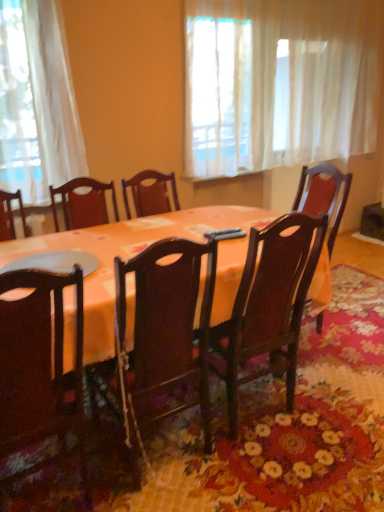
Question: Is white sheer curtain at upper center positioned beyond the bounds of orange fabric table at center?

Choices:
 (A) no
 (B) yes

Answer: (B)

Question: Is white sheer curtain at upper center further to the viewer compared to orange fabric table at center?

Choices:
 (A) yes
 (B) no

Answer: (A)

Question: Is white sheer curtain at upper center shorter than orange fabric table at center?

Choices:
 (A) yes
 (B) no

Answer: (B)

Question: Is white sheer curtain at upper center facing away from orange fabric table at center?

Choices:
 (A) no
 (B) yes

Answer: (A)

Question: Is white sheer curtain at upper center at the right side of orange fabric table at center?

Choices:
 (A) no
 (B) yes

Answer: (B)

Question: From the image's perspective, relative to white sheer curtain at upper center, is wooden chair at center, positioned as the second chair in left-to-right order, above or below?

Choices:
 (A) above
 (B) below

Answer: (B)

Question: Is wooden chair at center, which ranks as the 1th chair in right-to-left order, wider or thinner than white sheer curtain at upper center?

Choices:
 (A) thin
 (B) wide

Answer: (B)

Question: Looking at the image, does wooden chair at center, positioned as the second chair in left-to-right order, seem bigger or smaller compared to white sheer curtain at upper center?

Choices:
 (A) small
 (B) big

Answer: (A)

Question: From their relative heights in the image, would you say wooden chair at center, positioned as the second chair in left-to-right order, is taller or shorter than white sheer curtain at upper center?

Choices:
 (A) short
 (B) tall

Answer: (A)

Question: Is point (231, 230) closer or farther from the camera than point (43, 280)?

Choices:
 (A) closer
 (B) farther

Answer: (B)

Question: Looking at their shapes, would you say black plastic remote control at center is wider or thinner than matte dark wood chair at lower left, the 1th chair viewed from the left?

Choices:
 (A) wide
 (B) thin

Answer: (B)

Question: From the image's perspective, is black plastic remote control at center above or below matte dark wood chair at lower left, the second chair in the right-to-left sequence?

Choices:
 (A) above
 (B) below

Answer: (A)

Question: Is black plastic remote control at center inside or outside of matte dark wood chair at lower left, the second chair in the right-to-left sequence?

Choices:
 (A) inside
 (B) outside

Answer: (B)

Question: Considering their positions, is black plastic remote control at center located in front of or behind orange fabric table at center?

Choices:
 (A) front
 (B) behind

Answer: (B)

Question: Considering the positions of black plastic remote control at center and orange fabric table at center in the image, is black plastic remote control at center wider or thinner than orange fabric table at center?

Choices:
 (A) wide
 (B) thin

Answer: (B)